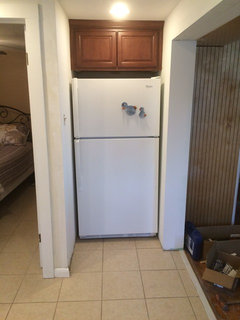
The height and width of the screenshot is (320, 240). Identify the location of mattress. (18, 160).